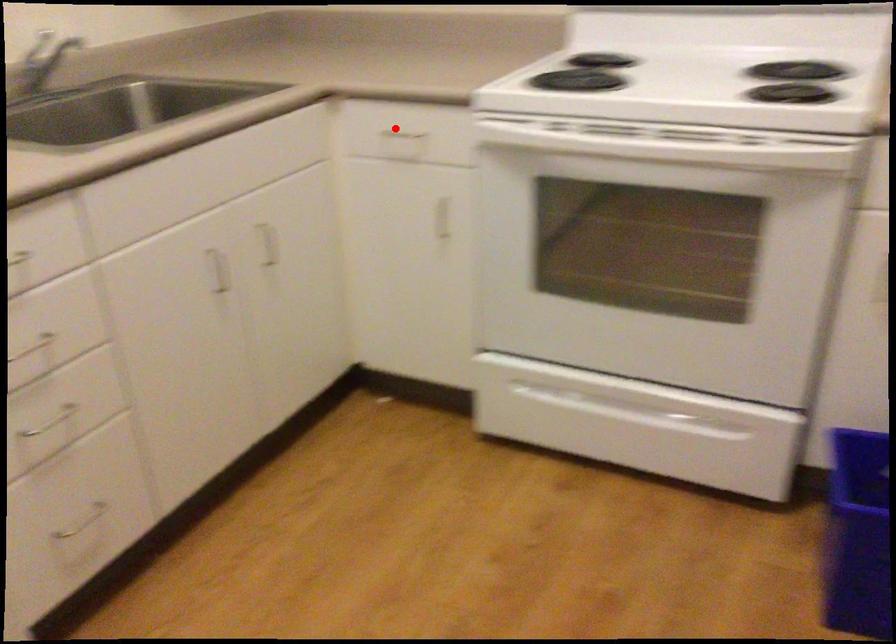
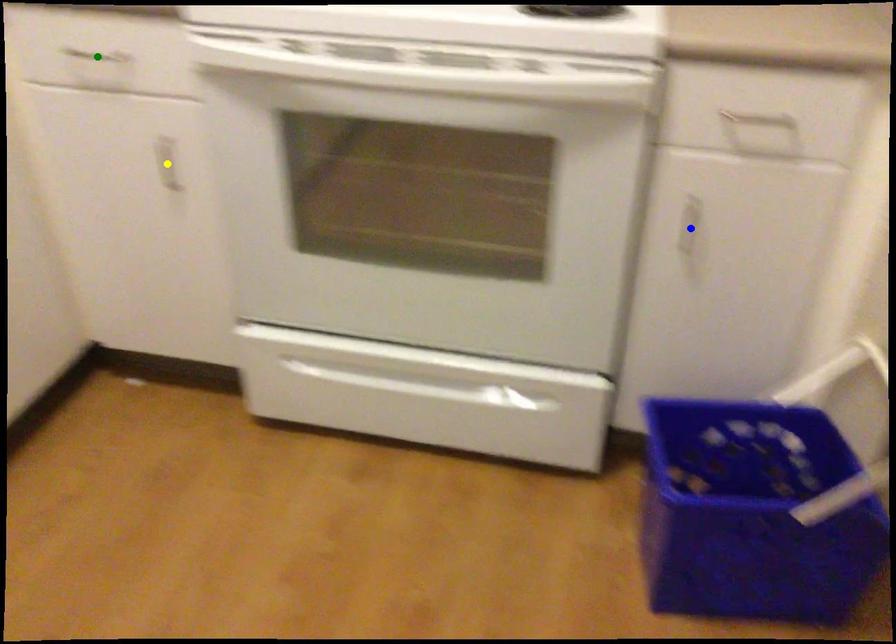
Question: I am providing you with two images of the same scene from different viewpoints. A red point is marked on the first image. You are given multiple points on the second image. In image 2, which mark is for the same physical point as the one in image 1?

Choices:
 (A) green point
 (B) yellow point
 (C) blue point

Answer: (A)